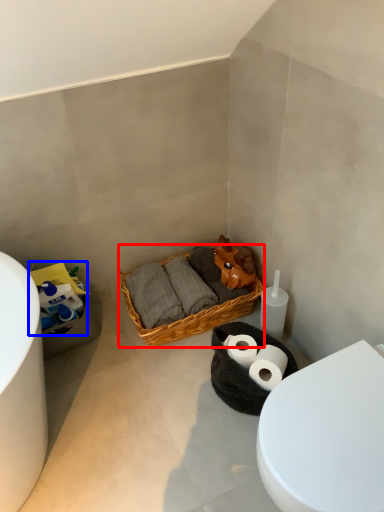
Question: Which object is further to the camera taking this photo, picnic basket (highlighted by a red box) or toilet paper (highlighted by a blue box)?

Choices:
 (A) picnic basket
 (B) toilet paper

Answer: (A)